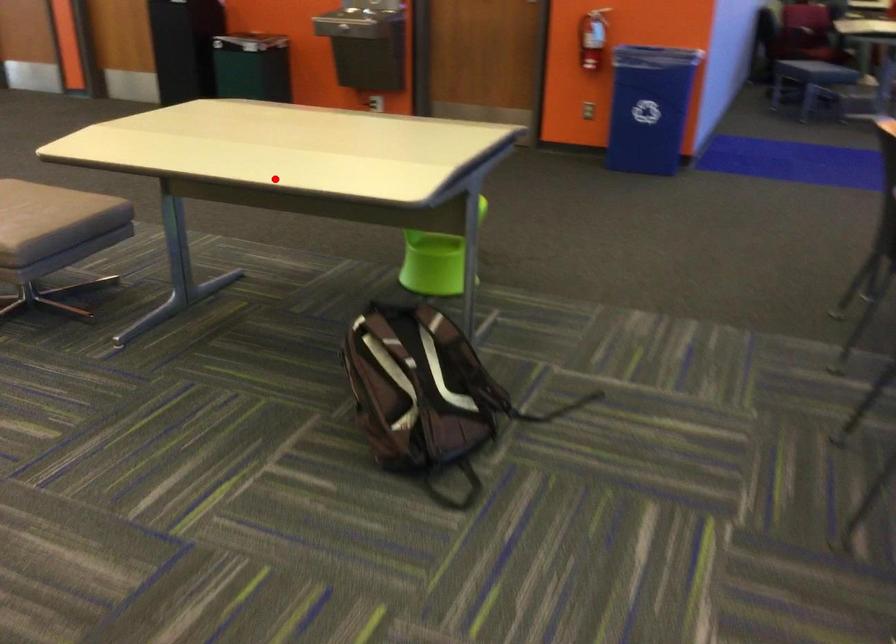
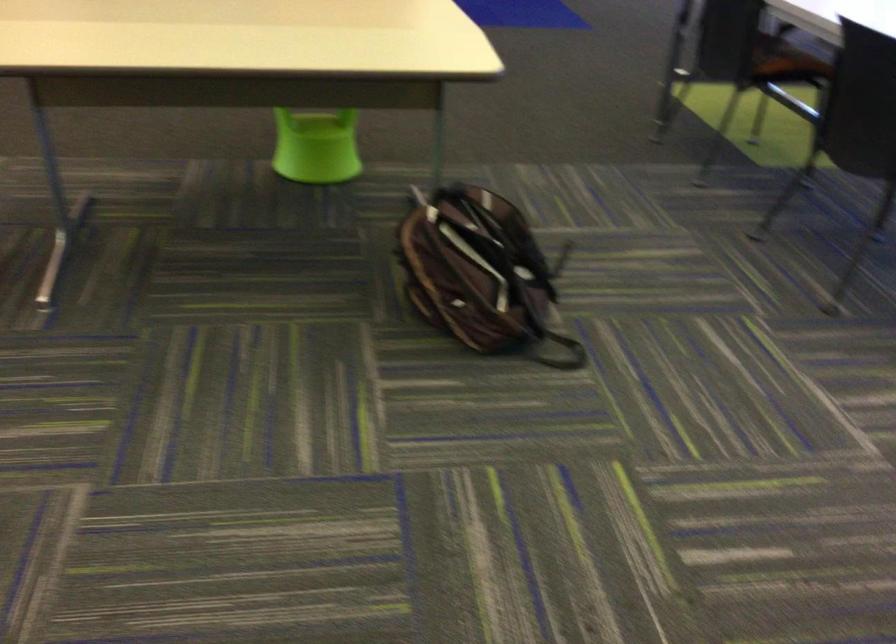
In the second image, find the point that corresponds to the highlighted location in the first image.

(322, 67)